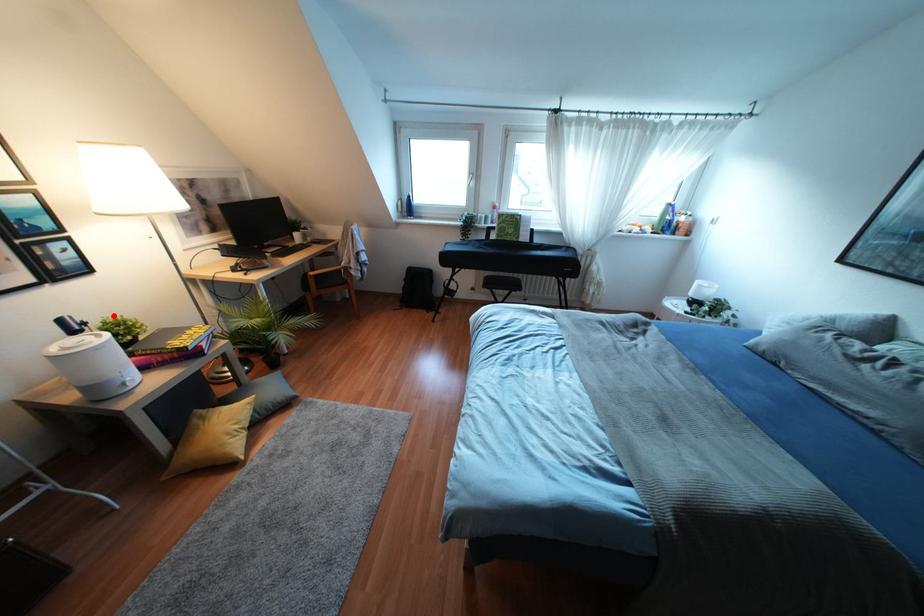
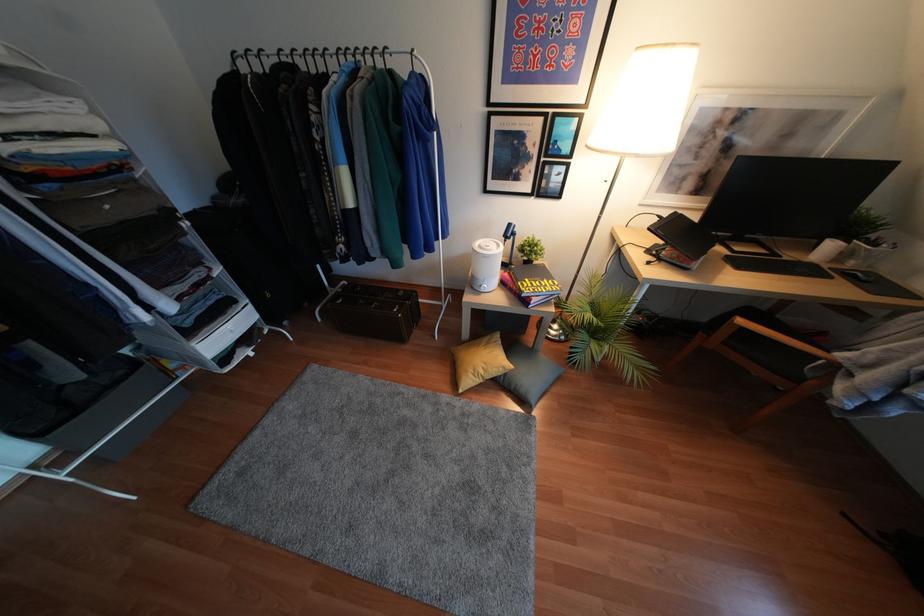
Question: I am providing you with two images of the same scene from different viewpoints. A red point is marked on the first image. Can you still see the location of the red point in image 2?

Choices:
 (A) Yes
 (B) No

Answer: (A)